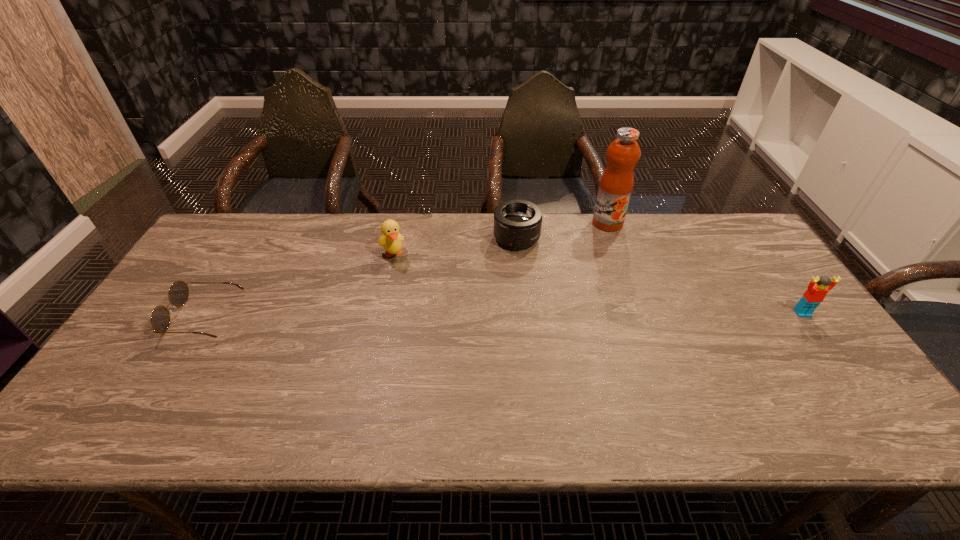
Locate an element on the screen. This screenshot has width=960, height=540. vacant area located 0.210m on the front-facing side of the duckling is located at coordinates (416, 310).

This screenshot has width=960, height=540. In order to click on free space located 0.210m on the front-facing side of the duckling in this screenshot , I will do `click(416, 310)`.

At what (x,y) coordinates should I click in order to perform the action: click on vacant space situated 0.380m on the side of the telephoto lens with brand markings and control switches. Please return your answer as a coordinate pair (x, y). The width and height of the screenshot is (960, 540). Looking at the image, I should click on (553, 348).

What are the coordinates of `blank space located on the side of the telephoto lens with brand markings and control switches` in the screenshot? It's located at (526, 268).

Find the location of a particular element. This screenshot has width=960, height=540. vacant space located 0.130m on the side of the telephoto lens with brand markings and control switches is located at coordinates (531, 281).

Locate an element on the screen. The width and height of the screenshot is (960, 540). free spot located 0.320m on the front label of the tallest object is located at coordinates (592, 296).

Identify the location of vacant space located on the front label of the tallest object. The height and width of the screenshot is (540, 960). (603, 248).

This screenshot has height=540, width=960. I want to click on vacant region located 0.070m on the front label of the tallest object, so click(x=603, y=244).

Locate an element on the screen. duckling at the far edge is located at coordinates (391, 239).

Where is `telephoto lens that is positioned at the far edge`? The image size is (960, 540). telephoto lens that is positioned at the far edge is located at coordinates (517, 223).